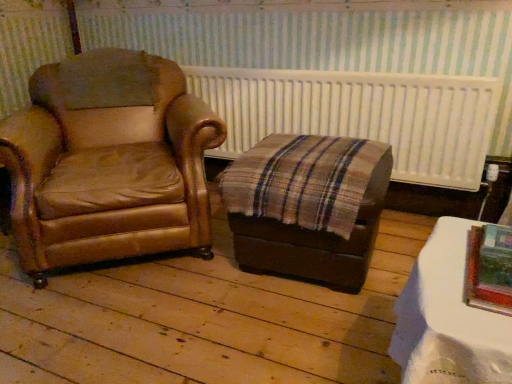
At what (x,y) coordinates should I click in order to perform the action: click on free point to the left of metallic silver picture frame at lower right. Please return your answer as a coordinate pair (x, y). This screenshot has width=512, height=384. Looking at the image, I should click on (450, 283).